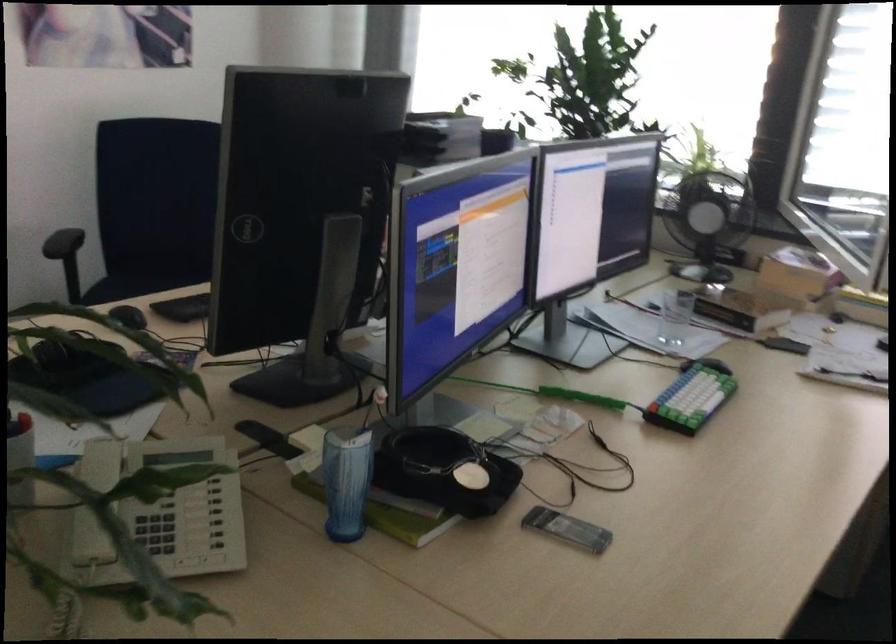
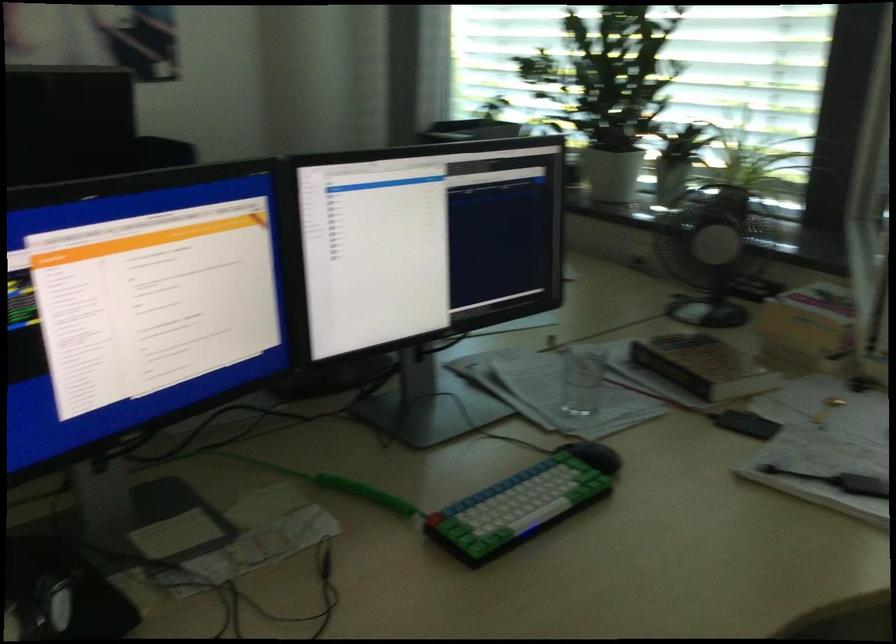
The images are taken continuously from a first-person perspective. In which direction are you moving?

The movement direction of the cameraman is right, forward.